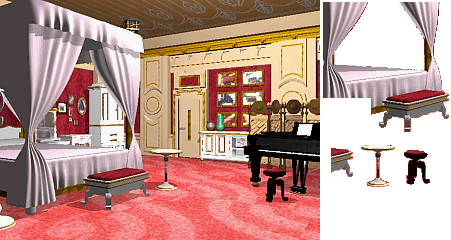
The width and height of the screenshot is (451, 240). In order to click on desk in this screenshot , I will do `click(220, 147)`.